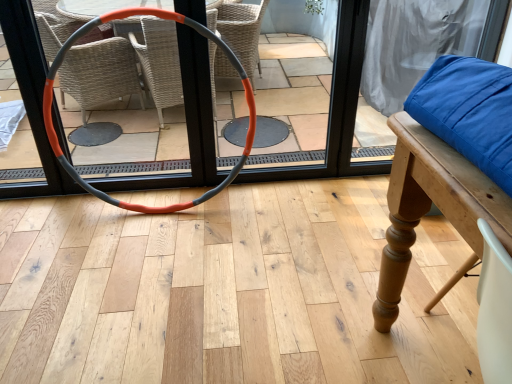
Question: Is orange-gray rubber hula hoop at center wider or thinner than orange rubber hoop at center?

Choices:
 (A) wide
 (B) thin

Answer: (A)

Question: From a real-world perspective, is orange-gray rubber hula hoop at center physically located above or below orange rubber hoop at center?

Choices:
 (A) below
 (B) above

Answer: (A)

Question: Does point (74, 39) appear closer or farther from the camera than point (23, 9)?

Choices:
 (A) farther
 (B) closer

Answer: (A)

Question: Does point (335, 142) appear closer or farther from the camera than point (248, 117)?

Choices:
 (A) closer
 (B) farther

Answer: (A)

Question: In the image, is orange rubber hoop at center positioned in front of or behind orange-gray rubber hula hoop at center?

Choices:
 (A) behind
 (B) front

Answer: (A)

Question: Considering the positions of orange rubber hoop at center and orange-gray rubber hula hoop at center in the image, is orange rubber hoop at center bigger or smaller than orange-gray rubber hula hoop at center?

Choices:
 (A) big
 (B) small

Answer: (B)

Question: Is orange rubber hoop at center inside the boundaries of orange-gray rubber hula hoop at center, or outside?

Choices:
 (A) outside
 (B) inside

Answer: (A)